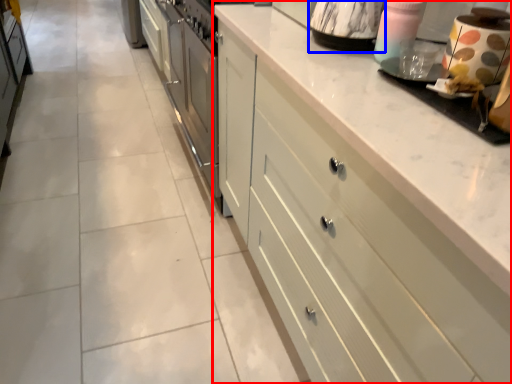
Question: Which of the following is the farthest to the observer, cabinetry (highlighted by a red box) or appliance (highlighted by a blue box)?

Choices:
 (A) cabinetry
 (B) appliance

Answer: (B)